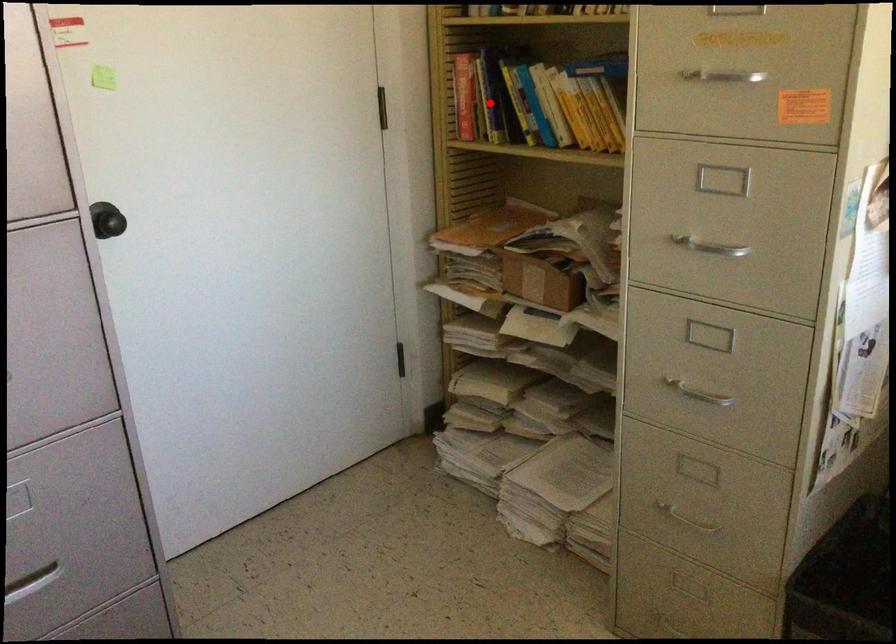
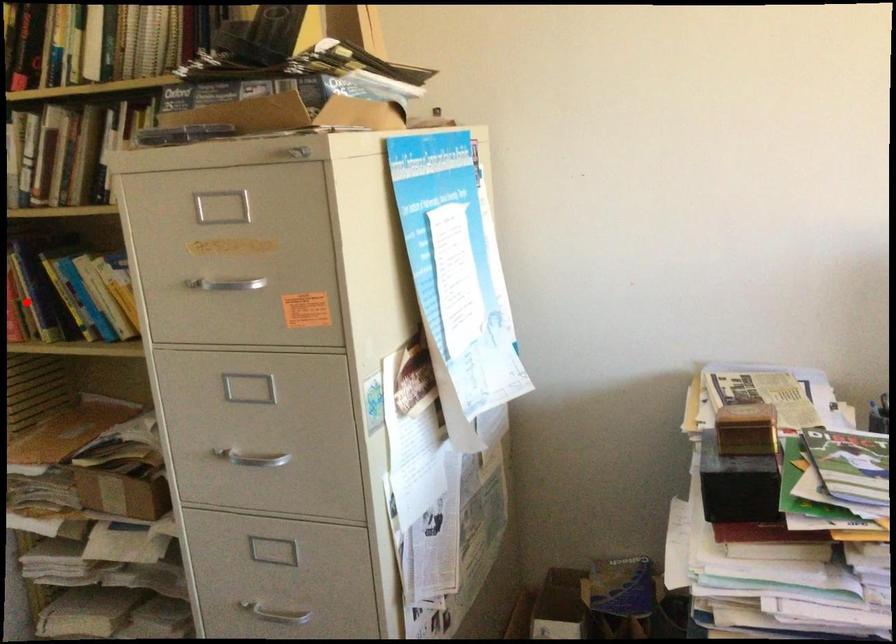
I am providing you with two images of the same scene from different viewpoints. A red point is marked on the first image and another point is marked on the second image. Is the red point in image1 aligned with the point shown in image2?

Yes